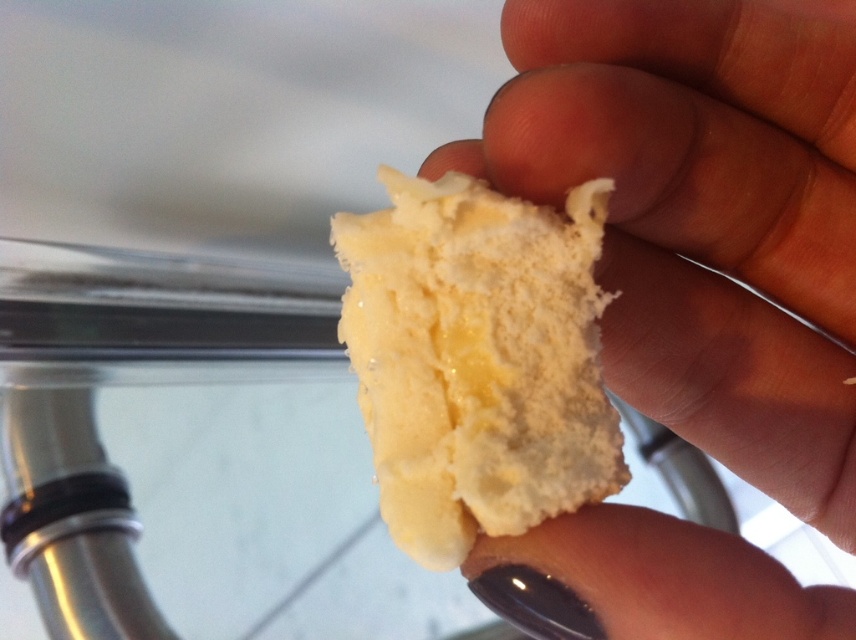
Does white fluffy sponge at center appear over yellow creamy sponge at center?

No.

Is white fluffy sponge at center bigger than yellow creamy sponge at center?

Correct, white fluffy sponge at center is larger in size than yellow creamy sponge at center.

Is point (484, 550) farther from camera compared to point (479, 413)?

No.

Identify the location of white fluffy sponge at center. (704, 214).